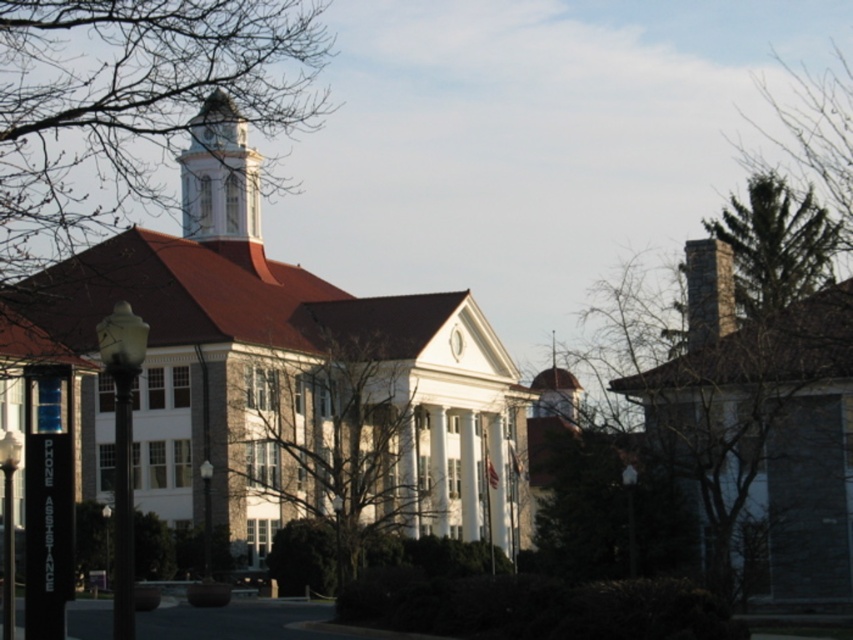
You are standing in front of the classical building and want to take a photo that includes both the bare branches at center and the green textured tree at upper right. Which object will appear larger in the photo?

The bare branches at center will appear larger in the photo because it is closer to the viewer than the green textured tree at upper right.

You are standing in front of the building and want to take a photo that includes both the white stone church at center and the green textured tree at upper right. Which direction should you move to ensure both are in the frame?

Move to the right so that the white stone church at center, which is to the left of the green textured tree at upper right, comes into view alongside the tree.